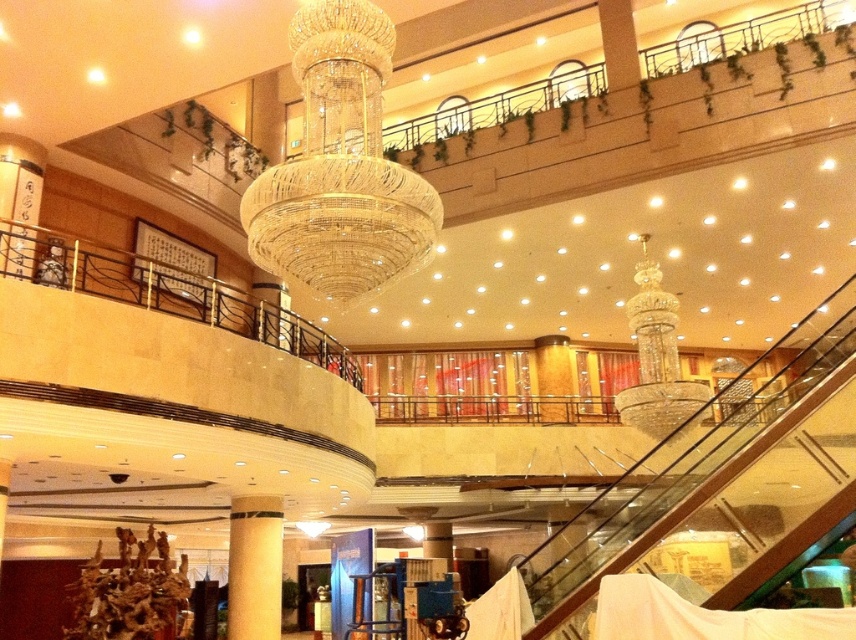
You are an interior designer assessing the space. You need to determine if the clear crystal chandelier at center can be lowered to the height of the yellow textured pillar at center. Based on the scene description, what is your conclusion?

The clear crystal chandelier at center is much taller than the yellow textured pillar at center. Lowering it to the pillar height would require shortening the chandelier or raising the pillar, which is not feasible. Thus, it cannot be lowered to match the pillar height.